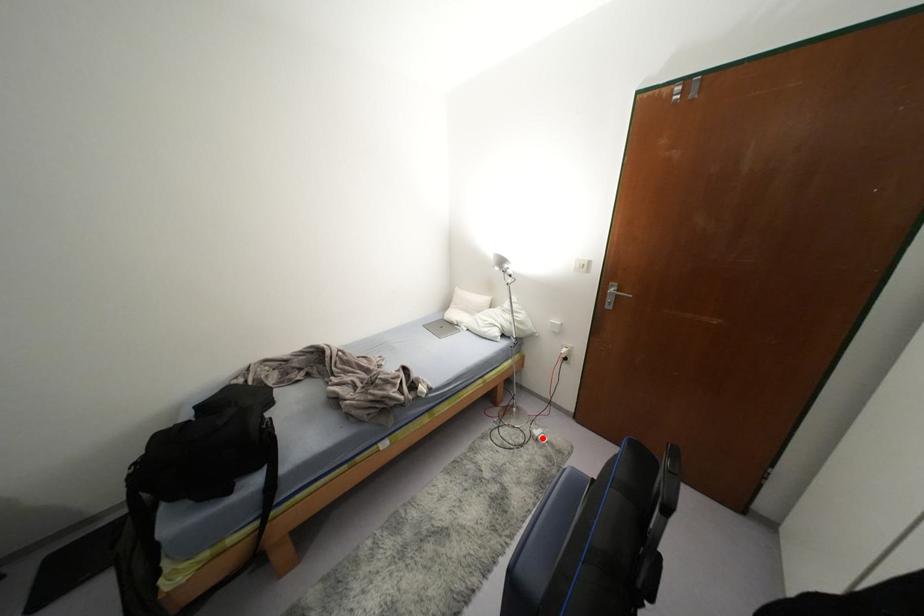
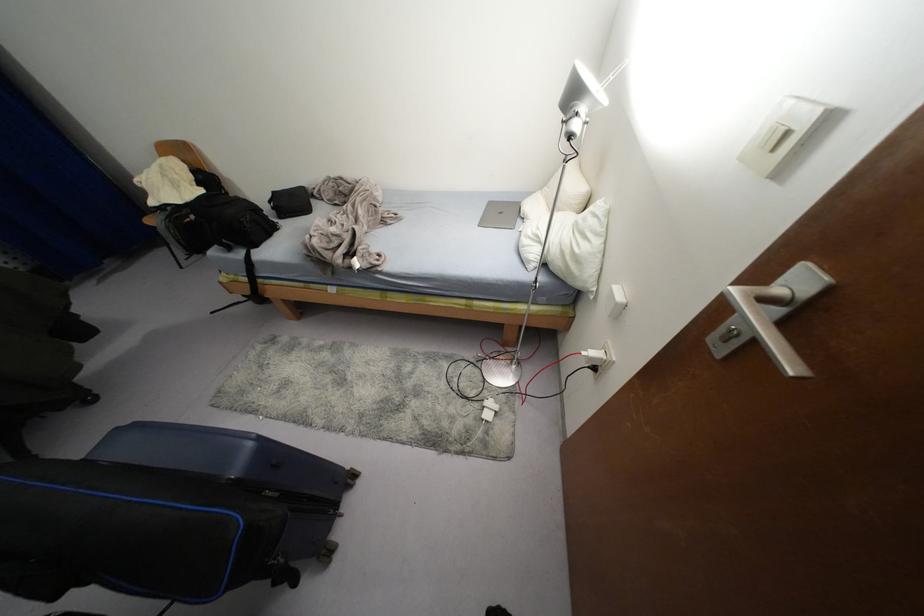
Question: I am providing you with two images of the same scene from different viewpoints. In image1, a red point is highlighted. Considering the same 3D point in image2, which of the following is correct?

Choices:
 (A) It is closer
 (B) It is farther

Answer: (B)